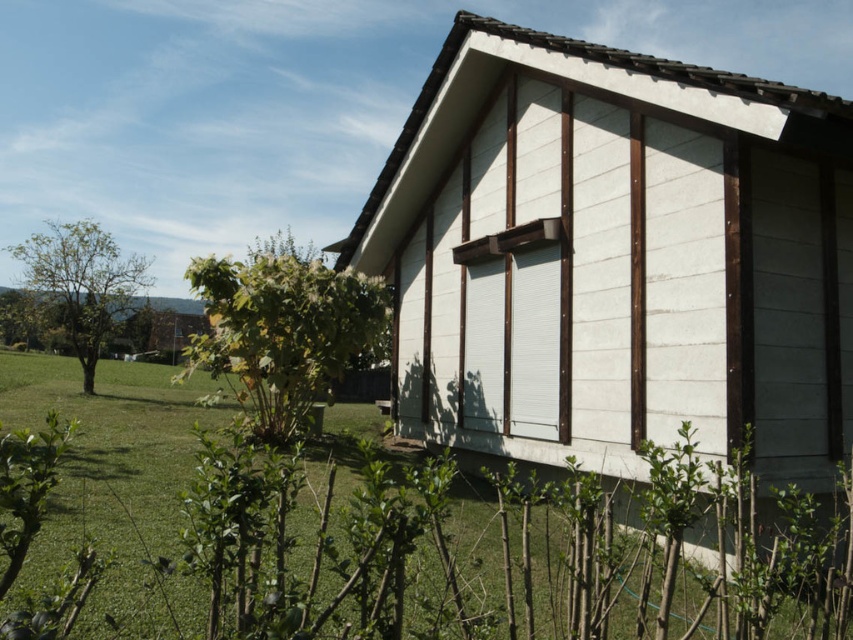
You are standing at the point marked by the coordinates point (x=283, y=330) in the image. What object are you directly at?

You are directly at the green leafy tree at center marked by the coordinates point (x=283, y=330).

You are standing in front of the house and notice the white wood hut at center and the green leafy tree at center. Which object is positioned to the right from your perspective?

The white wood hut at center is positioned to the right of the green leafy tree at center.

You are standing in front of the house and looking towards the green leafy tree at center. Based on the coordinates provided, is the tree closer to the top or bottom of the image?

The green leafy tree at center is located at point [283,330]. Since the y coordinate is 0.334, which is closer to 0.5 than 0, it is closer to the bottom of the image.